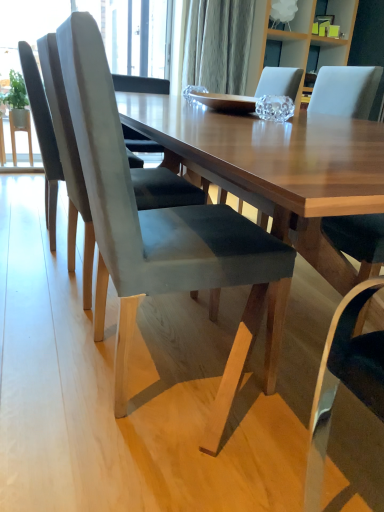
The height and width of the screenshot is (512, 384). Find the location of `vacant space positioned to the left of suede gray chair at center, which is the 1th chair in front-to-back order`. vacant space positioned to the left of suede gray chair at center, which is the 1th chair in front-to-back order is located at coordinates (42, 357).